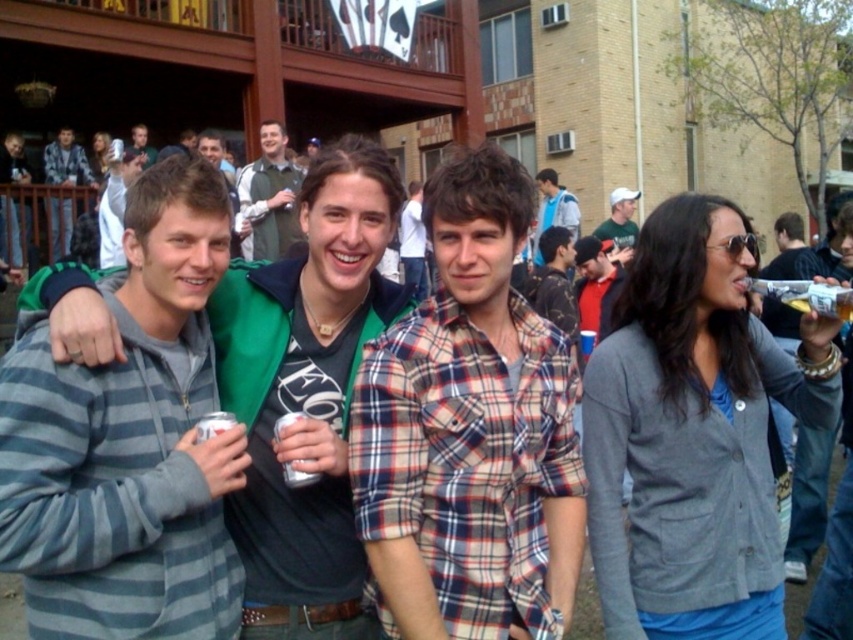
You are standing at the point labeled as point (469, 433). What is the closest object to you?

The closest object to you at point (469, 433) is the plaid cotton shirt at center.

You are a photographer at the event and want to capture both the plaid cotton shirt at center and the green fabric vest at upper center in the same frame. Can you adjust your position so that neither of them is blocking the other?

The plaid cotton shirt at center is in front of the green fabric vest at upper center, so you need to move your camera angle to the side to ensure both are visible without one blocking the other.

You are standing at the point labeled as point (469,433) in the image. What object is located at this point?

The point (469,433) is located on the plaid cotton shirt at center.